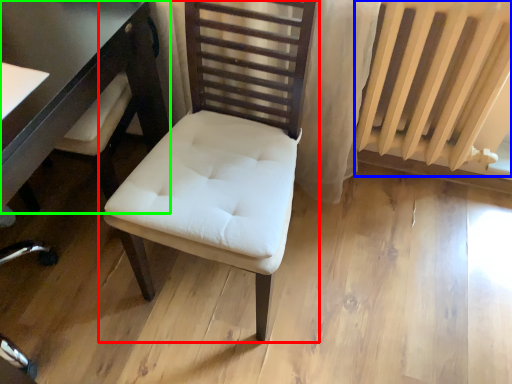
Question: Which object is the farthest from chair (highlighted by a red box)? Choose among these: radiator (highlighted by a blue box) or table (highlighted by a green box).

Choices:
 (A) radiator
 (B) table

Answer: (A)